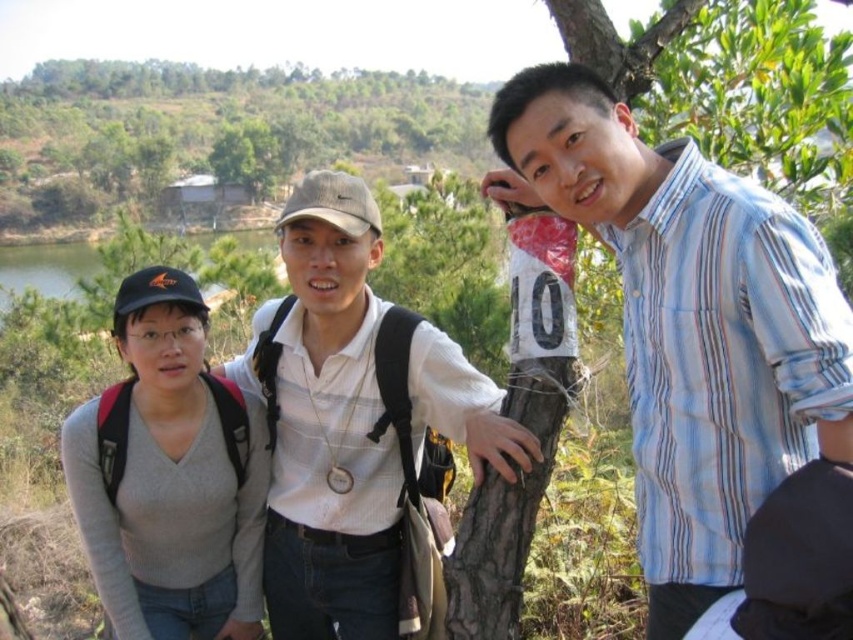
Does gray sweater at left have a greater width compared to gray matte sweater at left?

Yes, gray sweater at left is wider than gray matte sweater at left.

Who is positioned more to the left, gray sweater at left or gray matte sweater at left?

gray matte sweater at left is more to the left.

Is point (335, 593) closer to camera compared to point (184, 460)?

That is False.

This screenshot has height=640, width=853. What are the coordinates of `gray sweater at left` in the screenshot? It's located at (328, 422).

Who is more forward, (686, 365) or (86, 508)?

Point (686, 365) is in front.

Consider the image. Is blue striped shirt at right positioned in front of gray matte sweater at left?

Yes, blue striped shirt at right is closer to the viewer.

The width and height of the screenshot is (853, 640). What are the coordinates of `blue striped shirt at right` in the screenshot? It's located at (689, 323).

Between blue striped shirt at right and gray sweater at left, which one has more height?

blue striped shirt at right

Does blue striped shirt at right appear on the right side of gray sweater at left?

Correct, you'll find blue striped shirt at right to the right of gray sweater at left.

I want to click on blue striped shirt at right, so click(x=689, y=323).